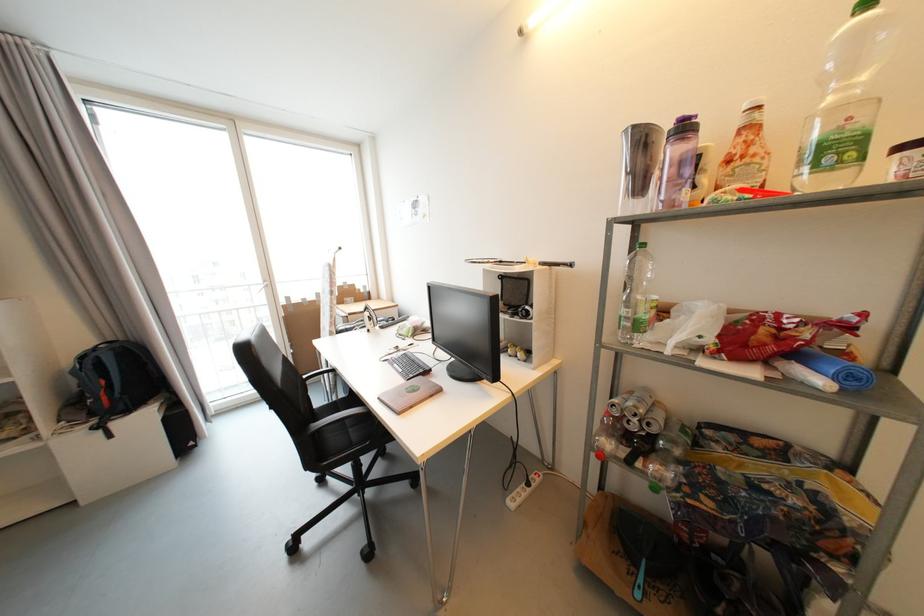
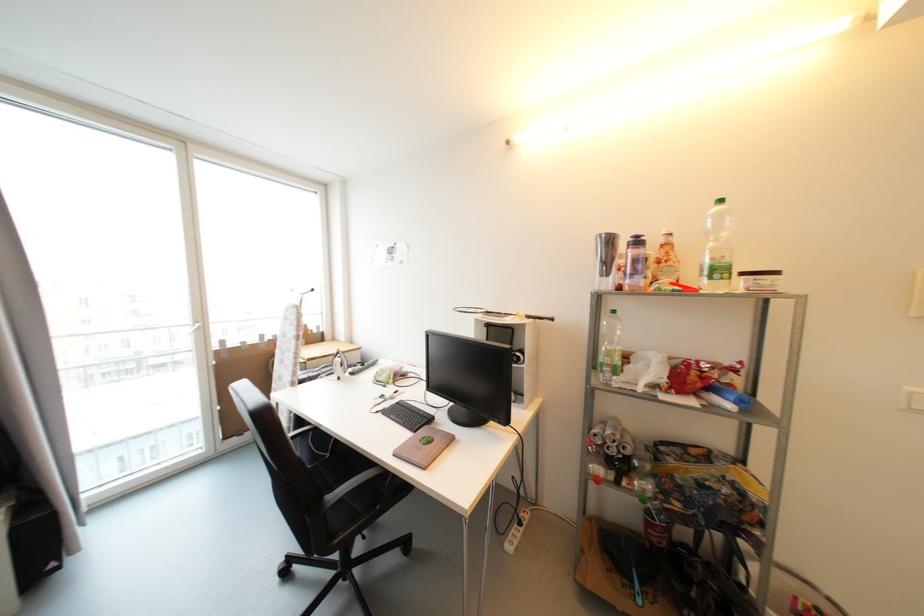
Locate, in the second image, the point that corresponds to [330,371] in the first image.

(295, 429)